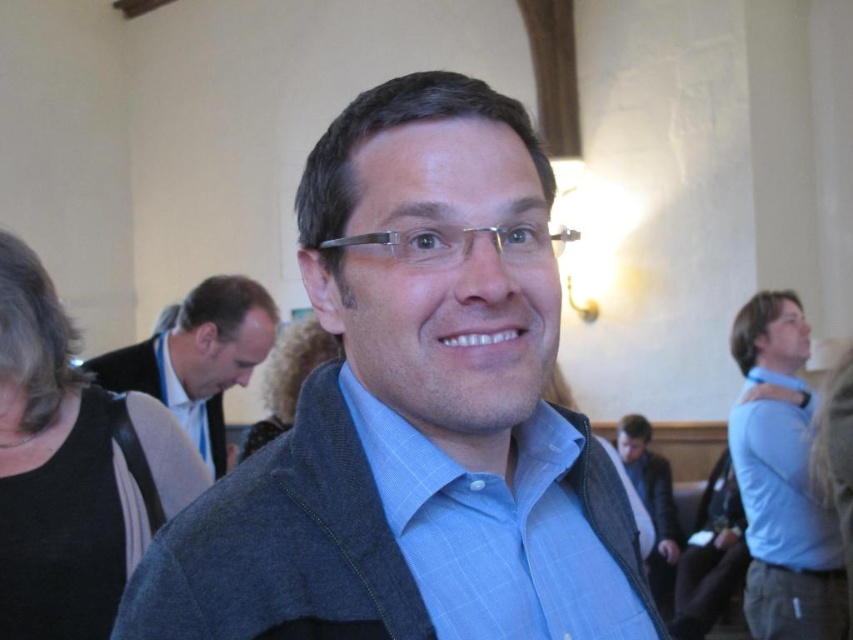
You are organizing a photo shoot and need to ensure that two shirts displayed in the image will fit on a 1.2 meter wide display stand. The shirts are the blue plaid shirt at center and the blue shirt at right. Based on the scene, can both shirts fit side by side on the stand?

The blue plaid shirt at center might be wider than blue shirt at right. However, since the exact width difference isn

You are organizing a clothing donation drive and need to categorize items based on their sizes. You have a blue textured shirt at center and a matte black jacket at center. Which item should you place in the small size bin?

The blue textured shirt at center has a smaller size compared to the matte black jacket at center, so it should be placed in the small size bin.